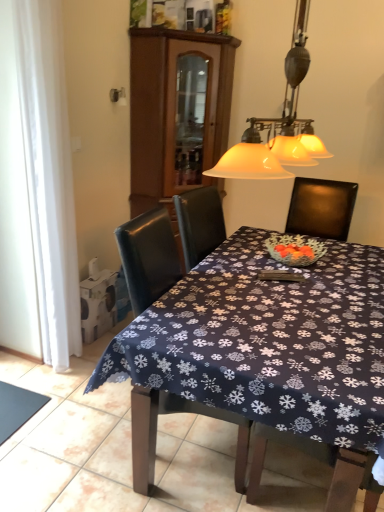
Identify the location of free space that is to the left of leather chair at center. The width and height of the screenshot is (384, 512). (79, 437).